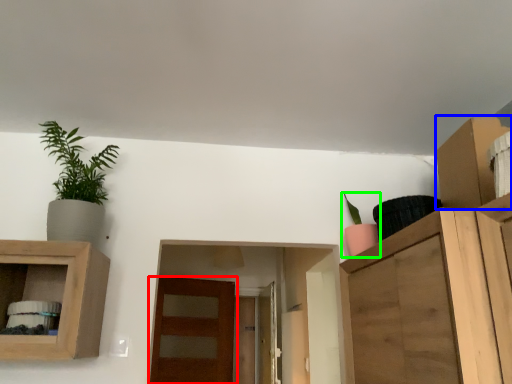
Question: Which is nearer to the door (highlighted by a red box)? cabinet (highlighted by a blue box) or houseplant (highlighted by a green box).

Choices:
 (A) cabinet
 (B) houseplant

Answer: (B)